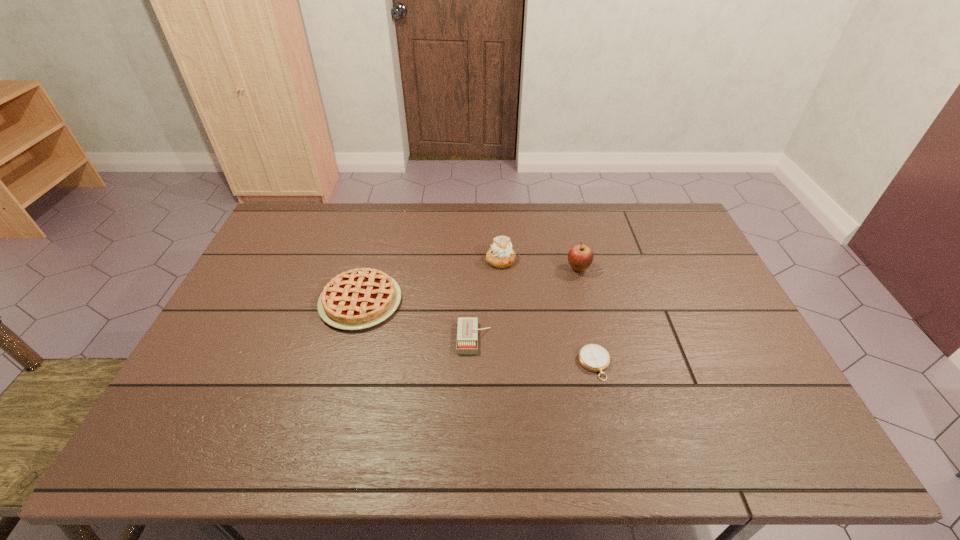
At what (x,y) coordinates should I click in order to perform the action: click on apple. Please return your answer as a coordinate pair (x, y). The height and width of the screenshot is (540, 960). Looking at the image, I should click on (580, 257).

Find the location of `pastry`. pastry is located at coordinates (501, 255).

At what (x,y) coordinates should I click in order to perform the action: click on the leftmost object. Please return your answer as a coordinate pair (x, y). The image size is (960, 540). Looking at the image, I should click on (360, 298).

Locate an element on the screen. pie is located at coordinates (360, 298).

Image resolution: width=960 pixels, height=540 pixels. I want to click on the second shortest object, so click(467, 332).

Image resolution: width=960 pixels, height=540 pixels. I want to click on the shortest object, so click(595, 358).

I want to click on vacant area located 0.210m on the back of the apple, so click(x=567, y=222).

The image size is (960, 540). Find the location of `vacant space located 0.270m on the back of the pastry`. vacant space located 0.270m on the back of the pastry is located at coordinates (498, 206).

Identify the location of vacant space located on the front of the third tallest object. The image size is (960, 540). (319, 456).

Where is `vacant space situated on the striking surface of the matchbox`? vacant space situated on the striking surface of the matchbox is located at coordinates (541, 338).